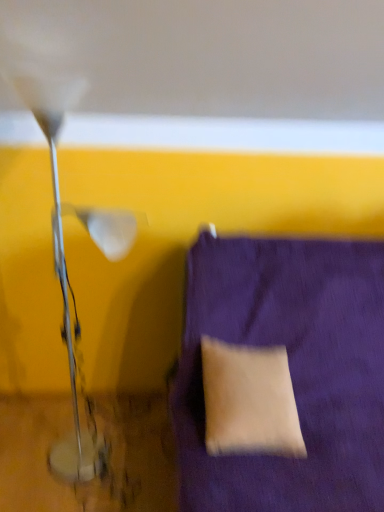
Question: Considering the relative sizes of metallic silver lamp at left and purple fabric cushion at lower right in the image provided, is metallic silver lamp at left smaller than purple fabric cushion at lower right?

Choices:
 (A) yes
 (B) no

Answer: (A)

Question: Does metallic silver lamp at left have a larger size compared to purple fabric cushion at lower right?

Choices:
 (A) no
 (B) yes

Answer: (A)

Question: Is the depth of metallic silver lamp at left greater than that of purple fabric cushion at lower right?

Choices:
 (A) no
 (B) yes

Answer: (B)

Question: Is metallic silver lamp at left facing towards purple fabric cushion at lower right?

Choices:
 (A) yes
 (B) no

Answer: (B)

Question: Considering the relative sizes of metallic silver lamp at left and purple fabric cushion at lower right in the image provided, is metallic silver lamp at left thinner than purple fabric cushion at lower right?

Choices:
 (A) no
 (B) yes

Answer: (B)

Question: Can you confirm if metallic silver lamp at left is positioned to the left of purple fabric cushion at lower right?

Choices:
 (A) yes
 (B) no

Answer: (A)

Question: Is beige fabric pillow at lower right at the left side of purple fabric cushion at lower right?

Choices:
 (A) no
 (B) yes

Answer: (B)

Question: Is beige fabric pillow at lower right not inside purple fabric cushion at lower right?

Choices:
 (A) yes
 (B) no

Answer: (B)

Question: Can you confirm if beige fabric pillow at lower right is bigger than purple fabric cushion at lower right?

Choices:
 (A) no
 (B) yes

Answer: (A)

Question: From the image's perspective, is beige fabric pillow at lower right on purple fabric cushion at lower right?

Choices:
 (A) no
 (B) yes

Answer: (B)

Question: Does beige fabric pillow at lower right appear on the right side of purple fabric cushion at lower right?

Choices:
 (A) no
 (B) yes

Answer: (A)

Question: From a real-world perspective, is beige fabric pillow at lower right on purple fabric cushion at lower right?

Choices:
 (A) yes
 (B) no

Answer: (A)

Question: Does purple fabric cushion at lower right contain metallic silver lamp at left?

Choices:
 (A) yes
 (B) no

Answer: (B)